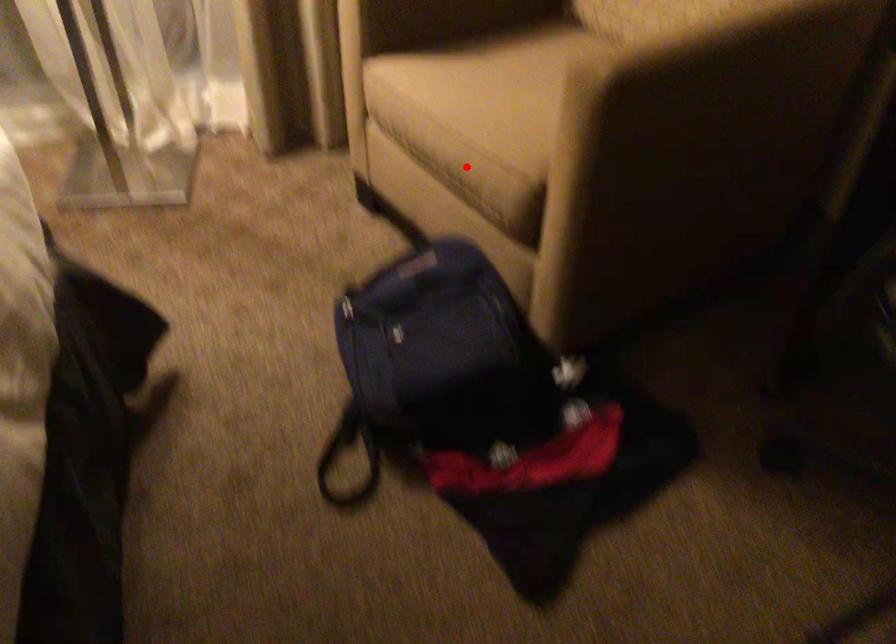
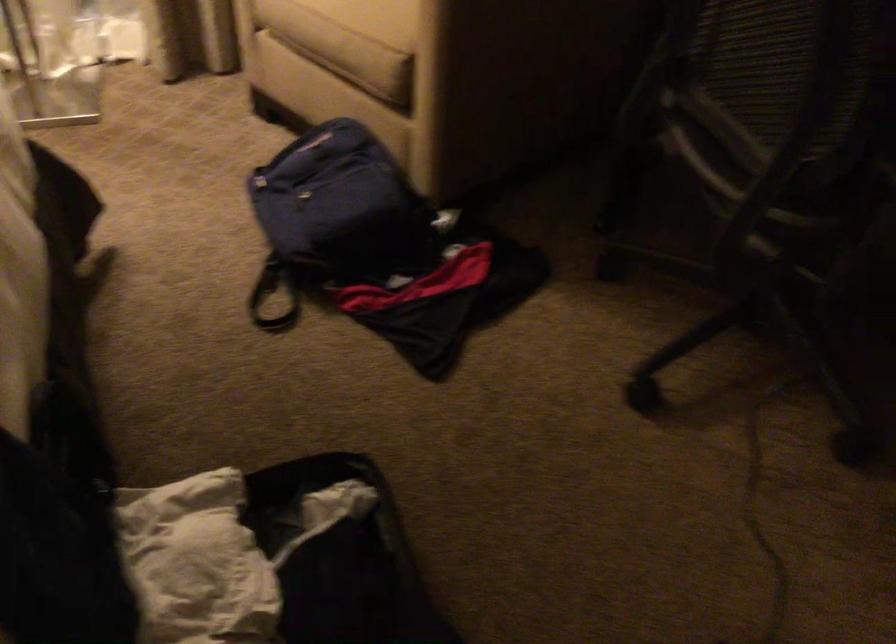
Question: I am providing you with two images of the same scene from different viewpoints. Image1 has a red point marked. In image2, the corresponding 3D location appears at what relative position? Reply with the corresponding letter.

Choices:
 (A) Closer
 (B) Farther

Answer: (B)